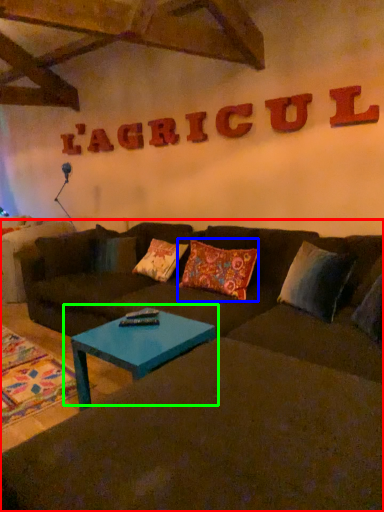
Question: Based on their relative distances, which object is nearer to studio couch (highlighted by a red box)? Choose from pillow (highlighted by a blue box) and coffee table (highlighted by a green box).

Choices:
 (A) pillow
 (B) coffee table

Answer: (B)